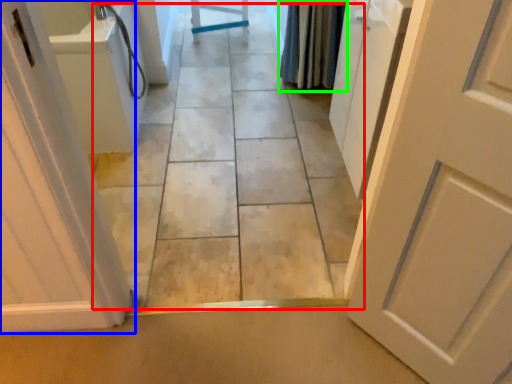
Question: Considering the real-world distances, which object is farthest from path (highlighted by a red box)? door (highlighted by a blue box) or shower curtain (highlighted by a green box)?

Choices:
 (A) door
 (B) shower curtain

Answer: (A)